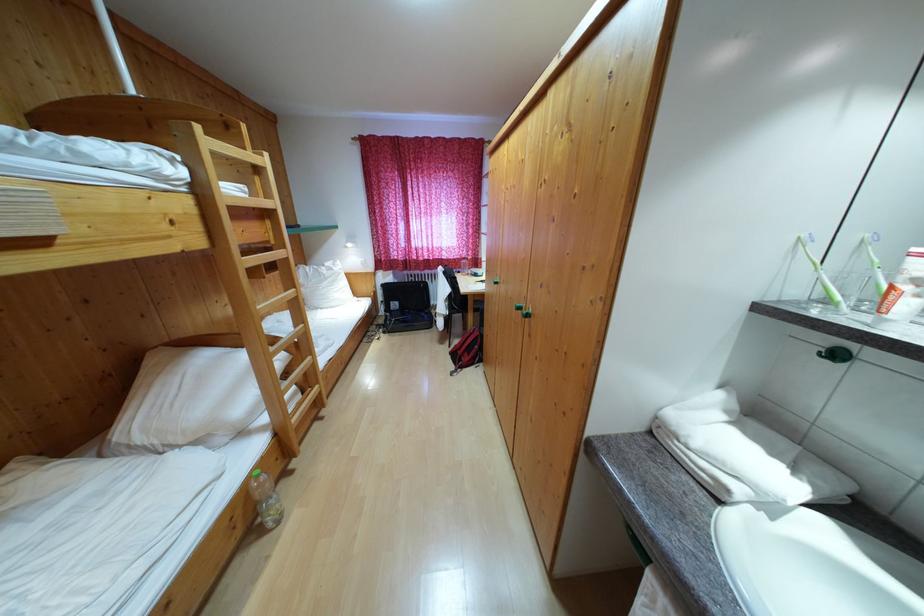
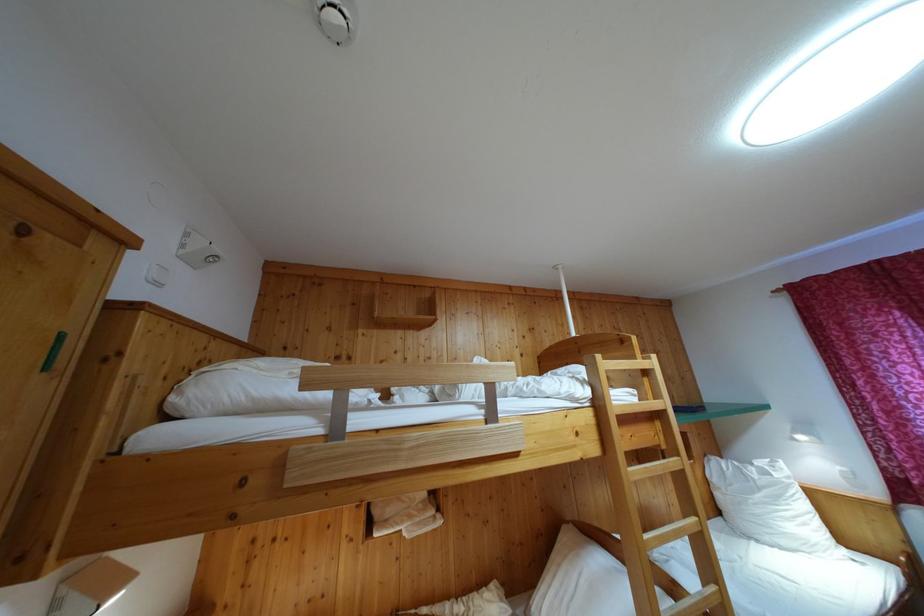
Find the pixel in the second image that matches point 327,273 in the first image.

(755, 471)